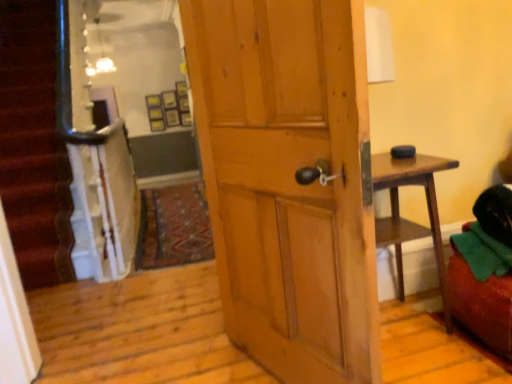
Question: Considering the positions of wooden door at center and velvet green bean bag chair at right in the image, is wooden door at center bigger or smaller than velvet green bean bag chair at right?

Choices:
 (A) small
 (B) big

Answer: (B)

Question: Is point (x=332, y=301) closer or farther from the camera than point (x=454, y=259)?

Choices:
 (A) closer
 (B) farther

Answer: (A)

Question: Considering the positions of wooden door at center and velvet green bean bag chair at right in the image, is wooden door at center taller or shorter than velvet green bean bag chair at right?

Choices:
 (A) tall
 (B) short

Answer: (A)

Question: Is velvet green bean bag chair at right in front of or behind wooden door at center in the image?

Choices:
 (A) behind
 (B) front

Answer: (A)

Question: From their relative heights in the image, would you say velvet green bean bag chair at right is taller or shorter than wooden door at center?

Choices:
 (A) tall
 (B) short

Answer: (B)

Question: From a real-world perspective, relative to wooden door at center, is velvet green bean bag chair at right vertically above or below?

Choices:
 (A) below
 (B) above

Answer: (A)

Question: From the image's perspective, is velvet green bean bag chair at right above or below wooden door at center?

Choices:
 (A) above
 (B) below

Answer: (B)